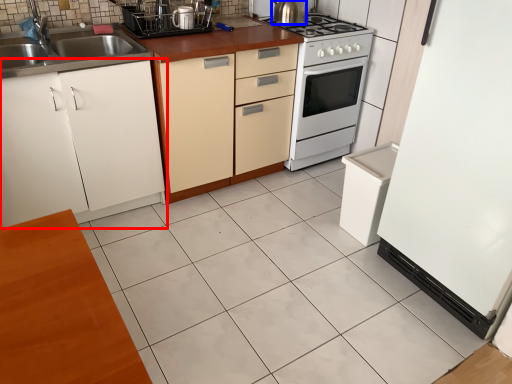
Question: Which of the following is the farthest to the observer, cabinetry (highlighted by a red box) or kitchen appliance (highlighted by a blue box)?

Choices:
 (A) cabinetry
 (B) kitchen appliance

Answer: (B)